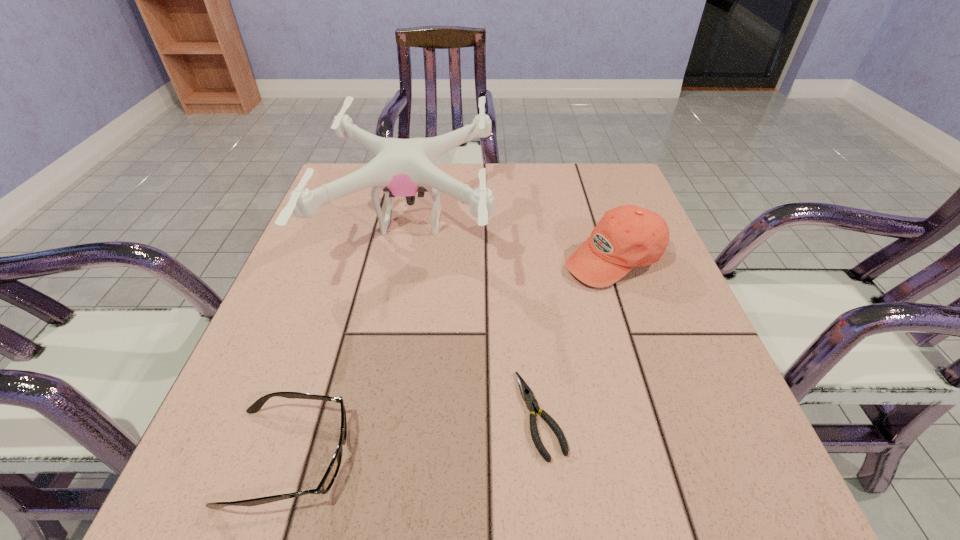
The height and width of the screenshot is (540, 960). Identify the location of object at the far edge. (401, 167).

I want to click on spectacles present at the near edge, so click(330, 475).

Image resolution: width=960 pixels, height=540 pixels. I want to click on pliers that is at the near edge, so click(x=527, y=394).

Find the location of a particular element. The height and width of the screenshot is (540, 960). drone that is at the left edge is located at coordinates (401, 167).

The width and height of the screenshot is (960, 540). In order to click on spectacles that is positioned at the left edge in this screenshot , I will do `click(330, 475)`.

At what (x,y) coordinates should I click in order to perform the action: click on object that is at the right edge. Please return your answer as a coordinate pair (x, y). This screenshot has height=540, width=960. Looking at the image, I should click on (627, 236).

Find the location of a particular element. This screenshot has height=540, width=960. object that is at the far left corner is located at coordinates (401, 167).

Image resolution: width=960 pixels, height=540 pixels. Identify the location of object positioned at the near left corner. (330, 475).

Where is `vacant space at the far edge of the desktop`? The width and height of the screenshot is (960, 540). vacant space at the far edge of the desktop is located at coordinates (489, 176).

In the image, there is a desktop. Identify the location of free space at the near edge. The image size is (960, 540). (454, 472).